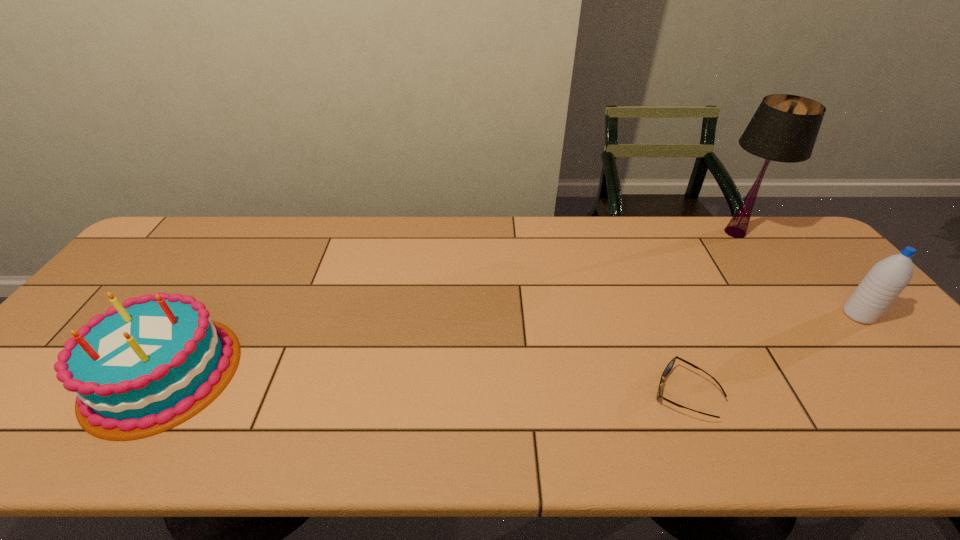
Image resolution: width=960 pixels, height=540 pixels. What are the coordinates of `unoccupied area between the leftmost object and the sunglasses` in the screenshot? It's located at tap(423, 383).

The image size is (960, 540). I want to click on free space between the birthday cake and the second object from left to right, so point(423,383).

Where is `vacant point located between the water bottle and the third object from right to left`? vacant point located between the water bottle and the third object from right to left is located at coordinates (771, 354).

Find the location of a particular element. The image size is (960, 540). free space between the leftmost object and the farthest object is located at coordinates [449, 303].

The width and height of the screenshot is (960, 540). I want to click on free area in between the shortest object and the rightmost object, so click(x=771, y=354).

Locate an element on the screen. object that is the closest to the second object from right to left is located at coordinates [887, 278].

Select which object is the second closest to the rightmost object. Please provide its 2D coordinates. Your answer should be formatted as a tuple, i.e. [(x, y)], where the tuple contains the x and y coordinates of a point satisfying the conditions above.

[(668, 368)]

Locate an element on the screen. The image size is (960, 540). free space that satisfies the following two spatial constraints: 1. on the back side of the leftmost object; 2. on the left side of the rightmost object is located at coordinates (200, 315).

Locate an element on the screen. vacant area in the image that satisfies the following two spatial constraints: 1. on the front-facing side of the farthest object; 2. at the front of the sunglasses showing the lenses is located at coordinates (851, 393).

What are the coordinates of `free space that satisfies the following two spatial constraints: 1. on the front-facing side of the water bottle; 2. on the right side of the farthest object` in the screenshot? It's located at (795, 315).